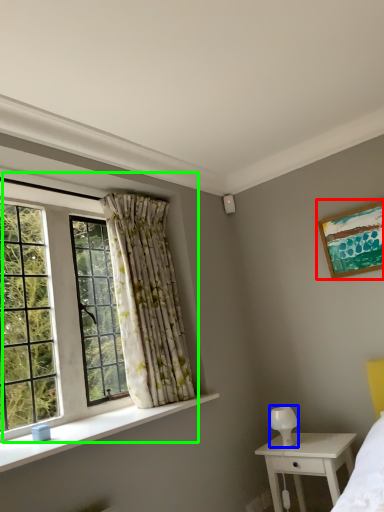
Question: Which object is positioned closest to picture frame (highlighted by a red box)? Select from lamp (highlighted by a blue box) and window (highlighted by a green box).

Choices:
 (A) lamp
 (B) window

Answer: (A)